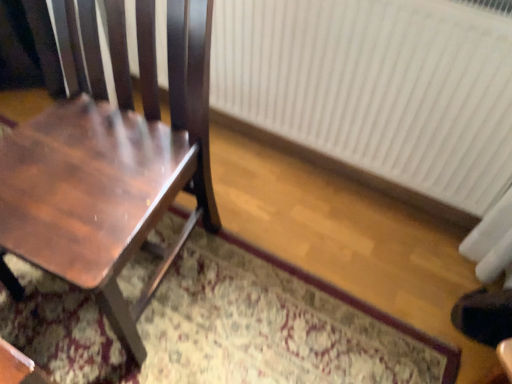
Question: Is white plastic radiator at right facing towards shiny brown wood chair at left?

Choices:
 (A) yes
 (B) no

Answer: (A)

Question: Is shiny brown wood chair at left inside white plastic radiator at right?

Choices:
 (A) yes
 (B) no

Answer: (B)

Question: Is white plastic radiator at right oriented away from shiny brown wood chair at left?

Choices:
 (A) no
 (B) yes

Answer: (A)

Question: Is white plastic radiator at right wider than shiny brown wood chair at left?

Choices:
 (A) no
 (B) yes

Answer: (A)

Question: Can you confirm if white plastic radiator at right is shorter than shiny brown wood chair at left?

Choices:
 (A) no
 (B) yes

Answer: (B)

Question: Would you say white plastic radiator at right is inside or outside patterned carpet at center?

Choices:
 (A) inside
 (B) outside

Answer: (B)

Question: From the image's perspective, is white plastic radiator at right located above or below patterned carpet at center?

Choices:
 (A) below
 (B) above

Answer: (B)

Question: Considering the positions of white plastic radiator at right and patterned carpet at center in the image, is white plastic radiator at right taller or shorter than patterned carpet at center?

Choices:
 (A) short
 (B) tall

Answer: (B)

Question: Looking at their shapes, would you say white plastic radiator at right is wider or thinner than patterned carpet at center?

Choices:
 (A) thin
 (B) wide

Answer: (A)

Question: Is patterned carpet at center wider or thinner than shiny brown wood chair at left?

Choices:
 (A) thin
 (B) wide

Answer: (B)

Question: Considering the positions of patterned carpet at center and shiny brown wood chair at left in the image, is patterned carpet at center bigger or smaller than shiny brown wood chair at left?

Choices:
 (A) big
 (B) small

Answer: (B)

Question: Would you say patterned carpet at center is to the left or to the right of shiny brown wood chair at left in the picture?

Choices:
 (A) left
 (B) right

Answer: (B)

Question: Is patterned carpet at center taller or shorter than shiny brown wood chair at left?

Choices:
 (A) tall
 (B) short

Answer: (B)

Question: From a real-world perspective, is patterned carpet at center physically located above or below white plastic radiator at right?

Choices:
 (A) above
 (B) below

Answer: (B)

Question: Considering the relative positions of patterned carpet at center and white plastic radiator at right in the image provided, is patterned carpet at center to the left or to the right of white plastic radiator at right?

Choices:
 (A) left
 (B) right

Answer: (A)